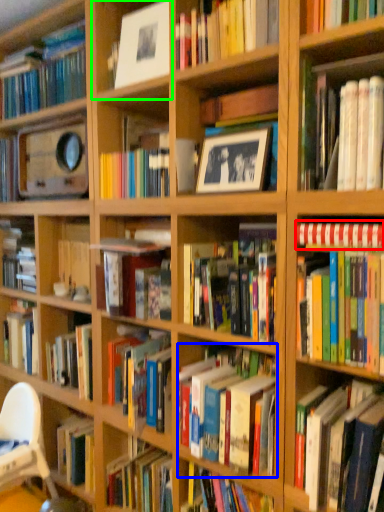
Question: Estimate the real-world distances between objects in this image. Which object is closer to book (highlighted by a red box), book (highlighted by a blue box) or shelf (highlighted by a green box)?

Choices:
 (A) book
 (B) shelf

Answer: (A)